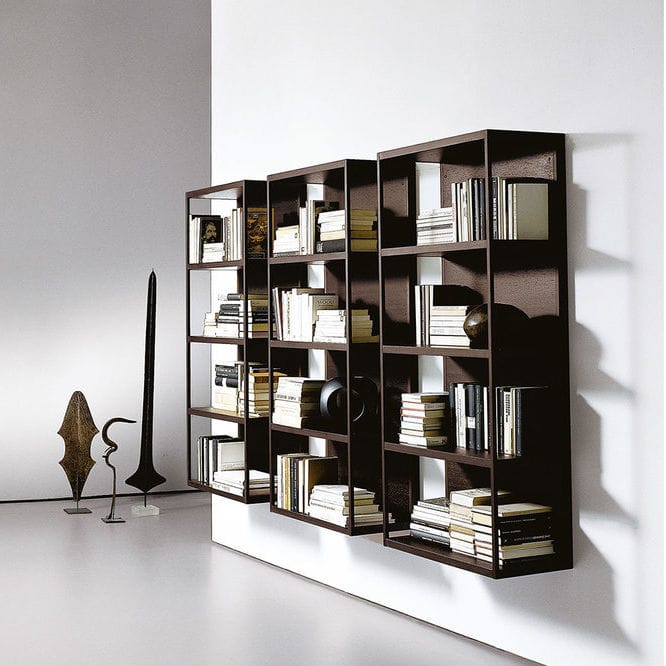
You are a GUI agent. You are given a task and a screenshot of the screen. Output one action in this format:
    pyautogui.click(x=<x>, y=<y>)
    Task: Click on the bookshelf four
    Image resolution: width=666 pixels, height=666 pixels.
    Given the screenshot: What is the action you would take?
    pyautogui.click(x=196, y=485), pyautogui.click(x=208, y=491), pyautogui.click(x=222, y=496), pyautogui.click(x=242, y=503)